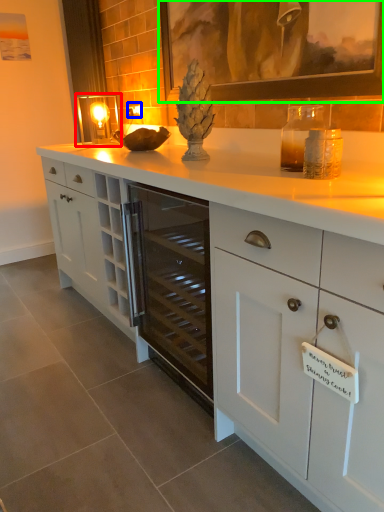
Question: Which is nearer to the candle holder (highlighted by a red box)? electric outlet (highlighted by a blue box) or picture frame (highlighted by a green box).

Choices:
 (A) electric outlet
 (B) picture frame

Answer: (A)